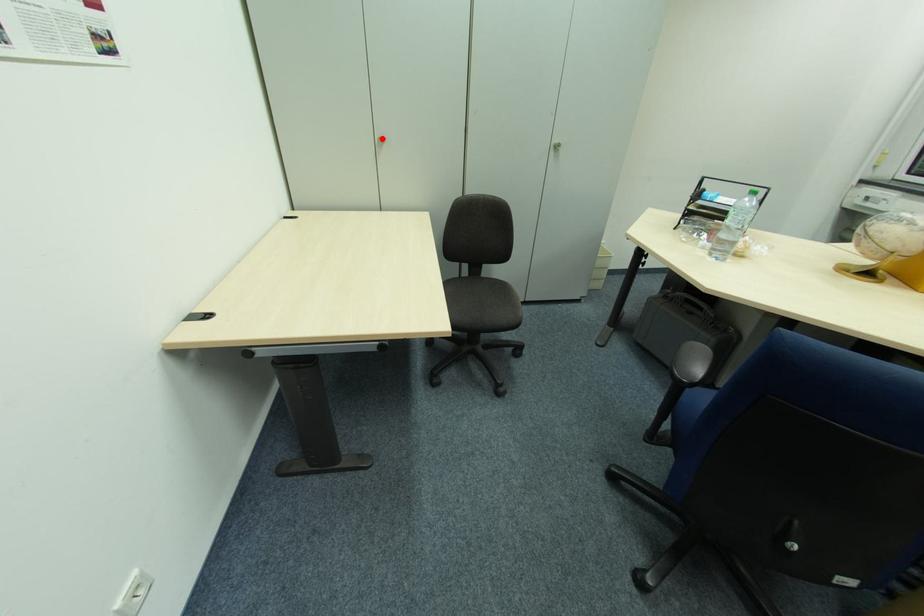
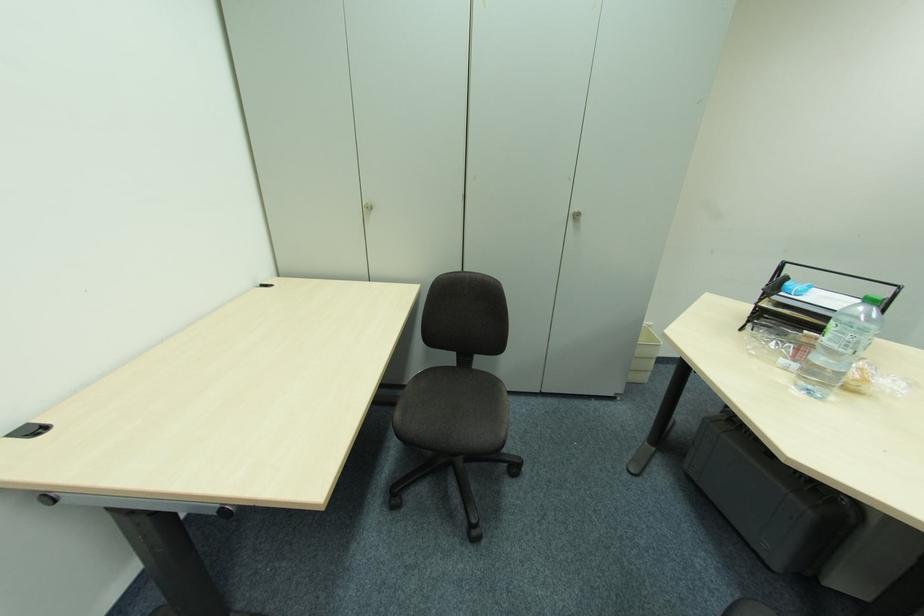
Locate, in the second image, the point that corresponds to the highlighted location in the first image.

(371, 206)